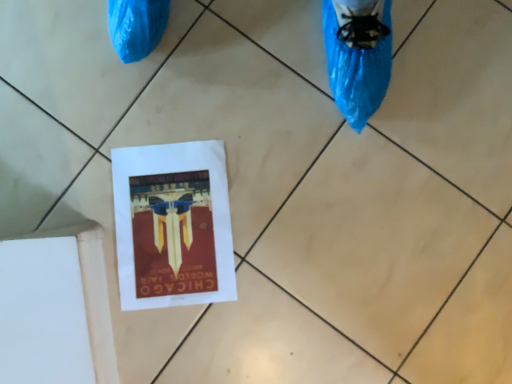
The height and width of the screenshot is (384, 512). What do you see at coordinates (374, 242) in the screenshot?
I see `white paper at center` at bounding box center [374, 242].

This screenshot has height=384, width=512. I want to click on white paper at center, so click(374, 242).

What do you see at coordinates (173, 225) in the screenshot? I see `matte paper flyer at center` at bounding box center [173, 225].

Where is `matte paper flyer at center`? Image resolution: width=512 pixels, height=384 pixels. matte paper flyer at center is located at coordinates (173, 225).

Locate an element on the screen. white paper at center is located at coordinates (374, 242).

Would you say white paper at center is to the left or to the right of matte paper flyer at center in the picture?

Clearly, white paper at center is on the right of matte paper flyer at center in the image.

Does white paper at center come behind matte paper flyer at center?

No, the depth of white paper at center is less than that of matte paper flyer at center.

Between point (358, 261) and point (189, 207), which one is positioned behind?

The point (189, 207) is more distant.

From the image's perspective, which one is positioned higher, white paper at center or matte paper flyer at center?

matte paper flyer at center is shown above in the image.

From a real-world perspective, is white paper at center physically below matte paper flyer at center?

Actually, white paper at center is physically above matte paper flyer at center in the real world.

Between white paper at center and matte paper flyer at center, which one has larger width?

matte paper flyer at center.

Does white paper at center have a greater height compared to matte paper flyer at center?

Yes.

Who is bigger, white paper at center or matte paper flyer at center?

white paper at center.

Is white paper at center located outside matte paper flyer at center?

Indeed, white paper at center is completely outside matte paper flyer at center.

Is there a large distance between white paper at center and matte paper flyer at center?

No, white paper at center is not far away from matte paper flyer at center.

Is white paper at center turned away from matte paper flyer at center?

Yes, white paper at center is positioned with its back facing matte paper flyer at center.

Can you tell me how much white paper at center and matte paper flyer at center differ in facing direction?

The angular difference between white paper at center and matte paper flyer at center is 3.93 degrees.

Find the location of `tile located in front of the matte paper flyer at center`. tile located in front of the matte paper flyer at center is located at coordinates (374, 242).

In the image, is matte paper flyer at center on the left side or the right side of white paper at center?

Clearly, matte paper flyer at center is on the left of white paper at center in the image.

Which object is further away from the camera, matte paper flyer at center or white paper at center?

matte paper flyer at center is behind.

Considering the points (126, 158) and (438, 198), which point is in front, point (126, 158) or point (438, 198)?

Positioned in front is point (438, 198).

From the image's perspective, between matte paper flyer at center and white paper at center, which one is located above?

matte paper flyer at center is shown above in the image.

From a real-world perspective, between matte paper flyer at center and white paper at center, who is vertically lower?

From a 3D spatial view, matte paper flyer at center is below.

In the scene shown: Which object is thinner, matte paper flyer at center or white paper at center?

With smaller width is white paper at center.

In terms of height, does matte paper flyer at center look taller or shorter compared to white paper at center?

Considering their sizes, matte paper flyer at center has less height than white paper at center.

Which of these two, matte paper flyer at center or white paper at center, is smaller?

With smaller size is matte paper flyer at center.

Is matte paper flyer at center completely or partially outside of white paper at center?

No, most part of matte paper flyer at center lies within white paper at center.

Is matte paper flyer at center placed right next to white paper at center?

No, matte paper flyer at center is not touching white paper at center.

Is matte paper flyer at center oriented away from white paper at center?

Yes, matte paper flyer at center's orientation is away from white paper at center.

How many degrees apart are the facing directions of matte paper flyer at center and white paper at center?

There is a 3.93-degree angle between the facing directions of matte paper flyer at center and white paper at center.

In the scene shown: Measure the distance between matte paper flyer at center and white paper at center.

9.10 inches.

In the image, there is a white paper at center. At what (x,y) coordinates should I click in order to perform the action: click on flyer below it (from a real-world perspective). Please return your answer as a coordinate pair (x, y). The width and height of the screenshot is (512, 384). Looking at the image, I should click on (173, 225).

Locate an element on the screen. The image size is (512, 384). tile below the matte paper flyer at center (from the image's perspective) is located at coordinates (374, 242).

Find the location of `tile in front of the matte paper flyer at center`. tile in front of the matte paper flyer at center is located at coordinates (374, 242).